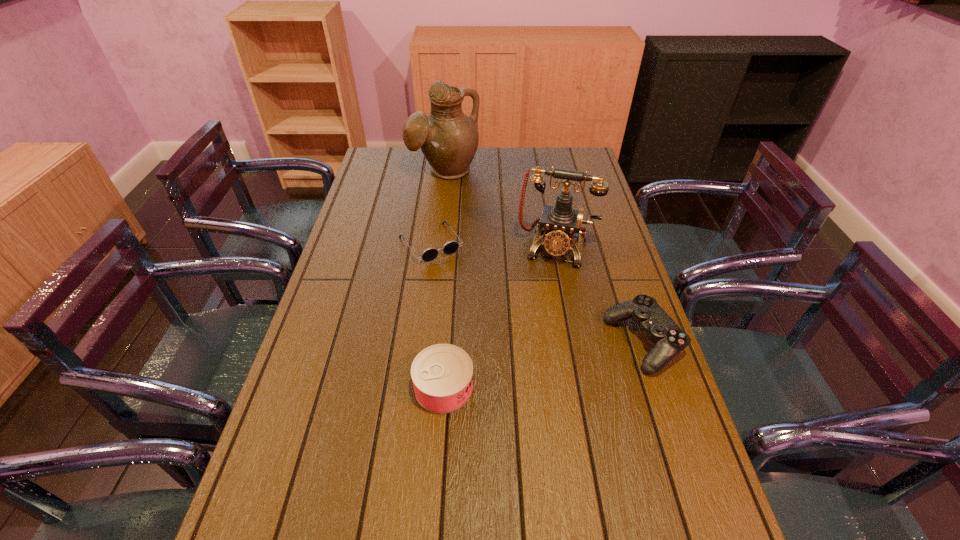
The width and height of the screenshot is (960, 540). I want to click on free space between the sunglasses and the control, so click(537, 293).

Locate an element on the screen. vacant space that's between the control and the can is located at coordinates (543, 365).

This screenshot has width=960, height=540. Identify the location of vacant space that's between the can and the pitcher. (444, 280).

Find the location of a particular element. empty space between the fourth shortest object and the can is located at coordinates (500, 318).

This screenshot has height=540, width=960. I want to click on the fourth closest object to the fourth shortest object, so click(442, 374).

This screenshot has width=960, height=540. In order to click on object that is the third closest to the fourth shortest object in this screenshot , I will do `click(448, 138)`.

This screenshot has width=960, height=540. In order to click on blank space that satisfies the following two spatial constraints: 1. on the front side of the pitcher; 2. on the left side of the control in this screenshot , I will do `click(426, 343)`.

Where is `free region that satisfies the following two spatial constraints: 1. on the front side of the pitcher; 2. on the left side of the can`? free region that satisfies the following two spatial constraints: 1. on the front side of the pitcher; 2. on the left side of the can is located at coordinates (420, 388).

Locate an element on the screen. This screenshot has height=540, width=960. vacant point that satisfies the following two spatial constraints: 1. on the front side of the fourth shortest object; 2. on the right side of the farthest object is located at coordinates (436, 248).